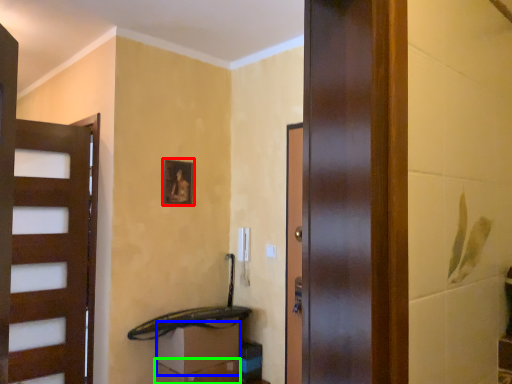
Question: Which object is positioned closest to picture frame (highlighted by a red box)? Select from drawer (highlighted by a blue box) and drawer (highlighted by a green box).

Choices:
 (A) drawer
 (B) drawer

Answer: (A)